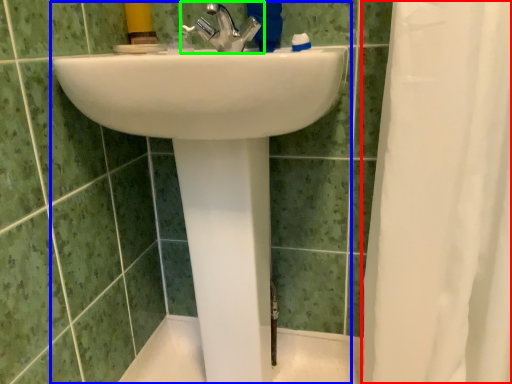
Question: Which is farther away from shower curtain (highlighted by a red box)? sink (highlighted by a blue box) or tap (highlighted by a green box)?

Choices:
 (A) sink
 (B) tap

Answer: (B)